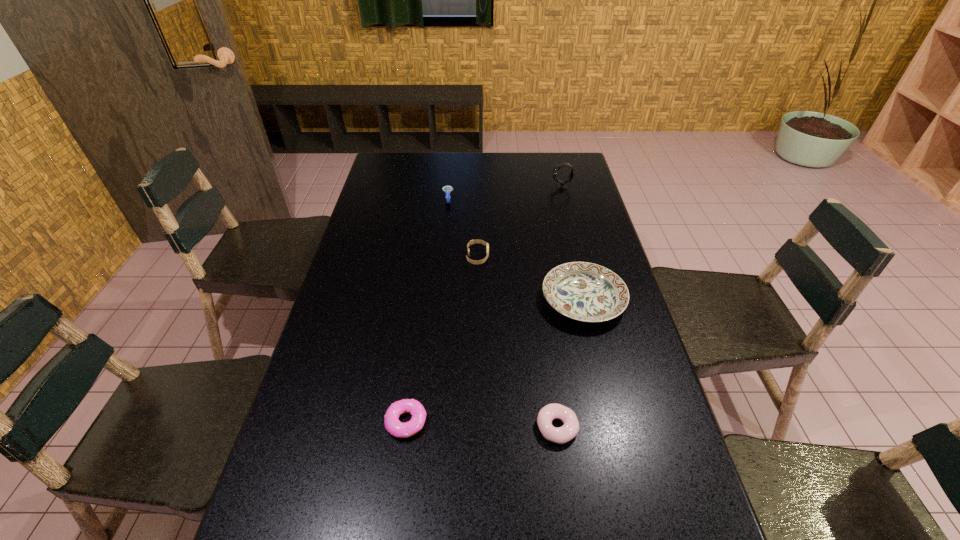
Where is `vacant space that's between the second watch from right to left and the leftmost watch`? The height and width of the screenshot is (540, 960). vacant space that's between the second watch from right to left and the leftmost watch is located at coordinates (463, 228).

What are the coordinates of `vacant space that is in between the plate and the tallest object` in the screenshot? It's located at (572, 244).

Where is `vacant space that's between the rightmost watch and the third nearest object`? The image size is (960, 540). vacant space that's between the rightmost watch and the third nearest object is located at coordinates (572, 244).

Point out which object is positioned as the fifth nearest to the left doughnut. Please provide its 2D coordinates. Your answer should be formatted as a tuple, i.e. [(x, y)], where the tuple contains the x and y coordinates of a point satisfying the conditions above.

[(561, 184)]

Locate which object is the fourth closest to the left doughnut. Please provide its 2D coordinates. Your answer should be formatted as a tuple, i.e. [(x, y)], where the tuple contains the x and y coordinates of a point satisfying the conditions above.

[(447, 189)]

This screenshot has height=540, width=960. In order to click on the closest watch to the second farthest object in this screenshot , I will do `click(471, 242)`.

Choose which watch is the third nearest neighbor to the left doughnut. Please provide its 2D coordinates. Your answer should be formatted as a tuple, i.e. [(x, y)], where the tuple contains the x and y coordinates of a point satisfying the conditions above.

[(561, 184)]

You are a GUI agent. You are given a task and a screenshot of the screen. Output one action in this format:
    pyautogui.click(x=<x>, y=<y>)
    Task: Click on the vacant space that satisfies the following two spatial constraints: 1. on the back side of the plate; 2. on the face of the nearest watch
    The width and height of the screenshot is (960, 540).
    Given the screenshot: What is the action you would take?
    pyautogui.click(x=573, y=257)

This screenshot has width=960, height=540. Find the location of `vacant space that satisfies the following two spatial constraints: 1. on the back side of the third nearest object; 2. on the face of the third object from left to right`. vacant space that satisfies the following two spatial constraints: 1. on the back side of the third nearest object; 2. on the face of the third object from left to right is located at coordinates pos(573,257).

The image size is (960, 540). In order to click on free space in the image that satisfies the following two spatial constraints: 1. on the face of the plate; 2. on the left side of the nearest watch in this screenshot , I will do `click(477, 300)`.